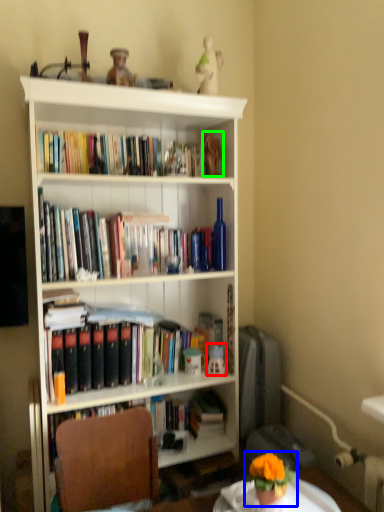
Question: Which is farther away from toy (highlighted by a red box)? houseplant (highlighted by a blue box) or toy (highlighted by a green box)?

Choices:
 (A) houseplant
 (B) toy

Answer: (B)